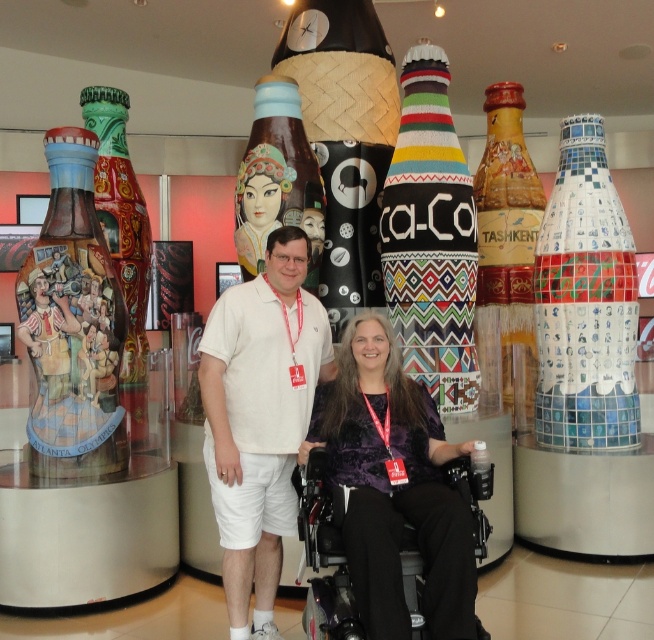
Question: Which point appears closest to the camera in this image?

Choices:
 (A) (449, 378)
 (B) (226, 346)
 (C) (63, 228)

Answer: (B)

Question: Does matte painted bottle at left have a greater width compared to painted wood bottle at left?

Choices:
 (A) yes
 (B) no

Answer: (B)

Question: Is mosaic glass bottle at right to the left of matte painted bottle at left from the viewer's perspective?

Choices:
 (A) no
 (B) yes

Answer: (A)

Question: Which point is farther to the camera?

Choices:
 (A) (84, 400)
 (B) (269, 460)
 (C) (129, 404)

Answer: (C)

Question: Among these objects, which one is farthest from the camera?

Choices:
 (A) matte brown bottle at center
 (B) knitted fabric coca-cola bottle at center
 (C) white cotton polo shirt at center
 (D) matte gold bottle at center

Answer: (D)

Question: From the image, what is the correct spatial relationship of matte painted bottle at left in relation to matte black bottle at center?

Choices:
 (A) left
 (B) right

Answer: (A)